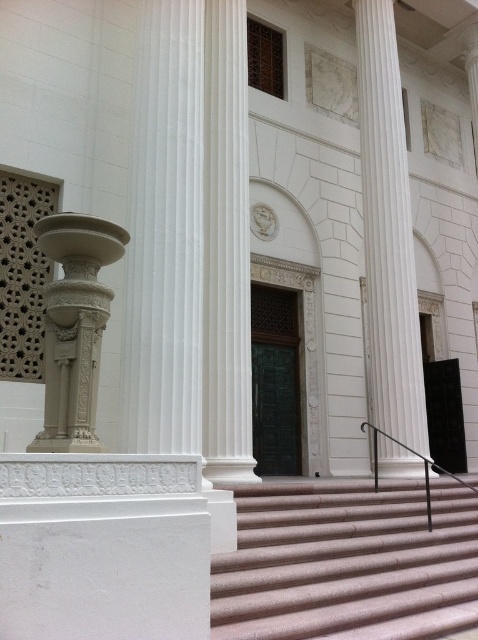
You are standing at the entrance of the grand building and want to reach the second floor. The pink textured stairs at center and the white marble column at center are in your way. Which one do you need to climb to reach the second floor?

The pink textured stairs at center is taller than the white marble column at center, so you need to climb the pink textured stairs at center to reach the second floor.

You are standing at the entrance of the grand building and want to locate the pink textured stairs at center. According to the coordinates provided, where exactly would you find them?

The pink textured stairs at center are located at point coordinates of (347, 563).